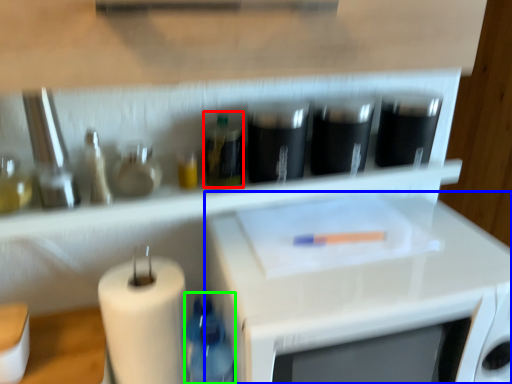
Question: Which object is positioned closest to bottle (highlighted by a red box)? Select from microwave (highlighted by a blue box) and bottle (highlighted by a green box).

Choices:
 (A) microwave
 (B) bottle

Answer: (B)